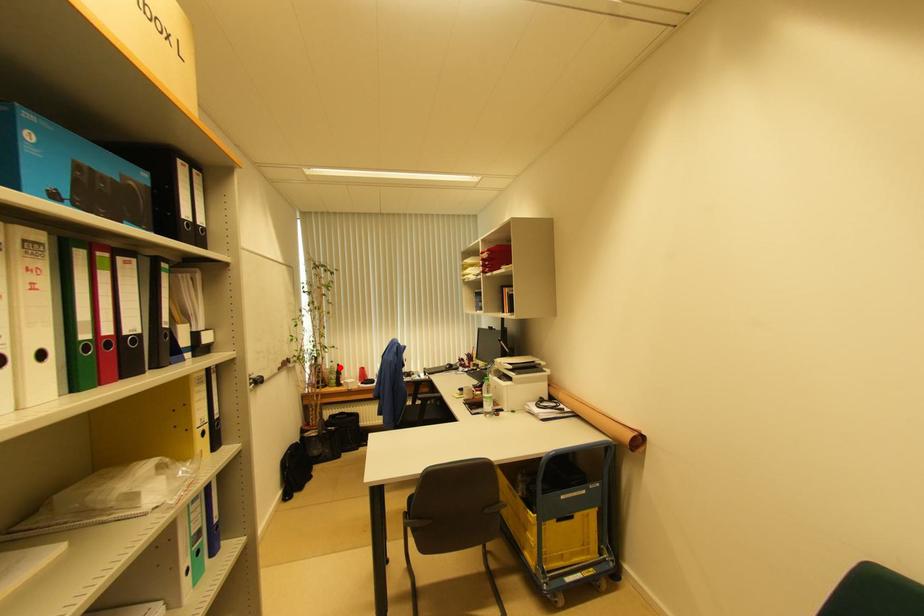
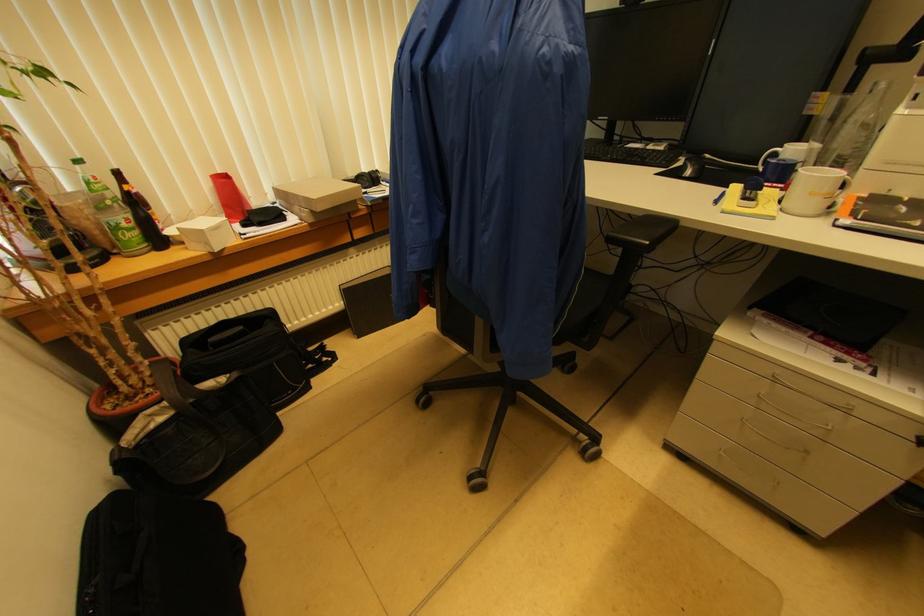
Question: I am providing you with two images of the same scene from different viewpoints. Given a red point in image1, look at the same physical point in image2. Is it:

Choices:
 (A) Closer to the viewpoint
 (B) Farther from the viewpoint

Answer: (A)